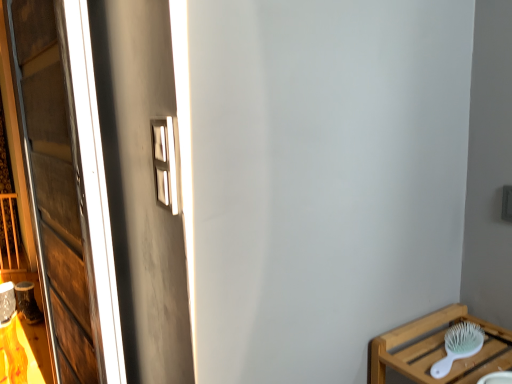
The image size is (512, 384). What do you see at coordinates (458, 346) in the screenshot?
I see `white plastic brush at lower right` at bounding box center [458, 346].

Identify the location of white plastic brush at lower right. (458, 346).

Image resolution: width=512 pixels, height=384 pixels. I want to click on wooden window at left, so click(x=66, y=185).

What do you see at coordinates (66, 185) in the screenshot? I see `wooden window at left` at bounding box center [66, 185].

The width and height of the screenshot is (512, 384). I want to click on white plastic brush at lower right, so click(458, 346).

Considering the positions of objects wooden window at left and white plastic brush at lower right in the image provided, who is more to the left, wooden window at left or white plastic brush at lower right?

wooden window at left.

Is wooden window at left closer to the viewer compared to white plastic brush at lower right?

Yes.

Considering the points (110, 358) and (465, 353), which point is in front, point (110, 358) or point (465, 353)?

The point (465, 353) is more forward.

From the image's perspective, is wooden window at left above or below white plastic brush at lower right?

wooden window at left is situated higher than white plastic brush at lower right in the image.

From a real-world perspective, between wooden window at left and white plastic brush at lower right, who is vertically higher?

From a 3D spatial view, wooden window at left is above.

Is wooden window at left wider than white plastic brush at lower right?

No.

Between wooden window at left and white plastic brush at lower right, which one has less height?

white plastic brush at lower right.

Between wooden window at left and white plastic brush at lower right, which one has smaller size?

With smaller size is white plastic brush at lower right.

Is white plastic brush at lower right surrounded by wooden window at left?

No, wooden window at left does not contain white plastic brush at lower right.

Consider the image. Is there a large distance between wooden window at left and white plastic brush at lower right?

wooden window at left is far away from white plastic brush at lower right.

Is wooden window at left facing towards white plastic brush at lower right?

No, wooden window at left is not turned towards white plastic brush at lower right.

Measure the distance between wooden window at left and white plastic brush at lower right.

wooden window at left is 1.14 meters away from white plastic brush at lower right.

The width and height of the screenshot is (512, 384). In order to click on brush on the right of wooden window at left in this screenshot , I will do `click(458, 346)`.

Would you say white plastic brush at lower right is to the left or to the right of wooden window at left in the picture?

Clearly, white plastic brush at lower right is on the right of wooden window at left in the image.

Is the depth of white plastic brush at lower right less than that of wooden window at left?

No, the depth of white plastic brush at lower right is greater than that of wooden window at left.

Does point (437, 365) come closer to viewer compared to point (81, 57)?

No.

From the image's perspective, relative to wooden window at left, is white plastic brush at lower right above or below?

white plastic brush at lower right is below wooden window at left.

From a real-world perspective, between white plastic brush at lower right and wooden window at left, who is vertically lower?

In real-world perspective, white plastic brush at lower right is lower.

Does white plastic brush at lower right have a lesser width compared to wooden window at left?

In fact, white plastic brush at lower right might be wider than wooden window at left.

Does white plastic brush at lower right have a greater height compared to wooden window at left?

Incorrect, the height of white plastic brush at lower right is not larger of that of wooden window at left.

In terms of size, does white plastic brush at lower right appear bigger or smaller than wooden window at left?

white plastic brush at lower right is smaller than wooden window at left.

Which is correct: white plastic brush at lower right is inside wooden window at left, or outside of it?

white plastic brush at lower right cannot be found inside wooden window at left.

Is white plastic brush at lower right beside wooden window at left?

There is a gap between white plastic brush at lower right and wooden window at left.

Is white plastic brush at lower right aimed at wooden window at left?

No, white plastic brush at lower right is not oriented towards wooden window at left.

Measure the distance from white plastic brush at lower right to wooden window at left.

white plastic brush at lower right and wooden window at left are 1.14 meters apart.

What are the coordinates of `brush located on the right of wooden window at left` in the screenshot? It's located at (458, 346).

Where is `window that is in front of the white plastic brush at lower right`? Image resolution: width=512 pixels, height=384 pixels. window that is in front of the white plastic brush at lower right is located at coordinates (66, 185).

Find the location of a particular element. This screenshot has width=512, height=384. window on the left of white plastic brush at lower right is located at coordinates (66, 185).